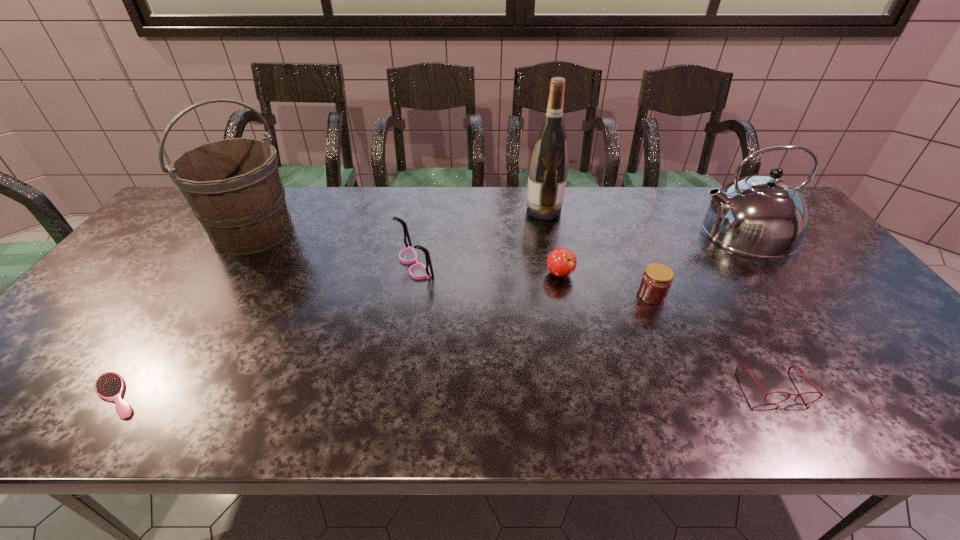
The image size is (960, 540). What are the coordinates of `free space between the apple and the sixth farthest object` in the screenshot? It's located at (606, 285).

At what (x,y) coordinates should I click in order to perform the action: click on unoccupied area between the apple and the sixth object from left to right. Please return your answer as a coordinate pair (x, y). Looking at the image, I should click on (606, 285).

Locate an element on the screen. object that is the fourth closest to the sixth farthest object is located at coordinates tap(548, 167).

You are a GUI agent. You are given a task and a screenshot of the screen. Output one action in this format:
    pyautogui.click(x=<x>, y=<y>)
    Task: Click on the object that is the sixth closest one to the hairbrush
    The height and width of the screenshot is (540, 960).
    Given the screenshot: What is the action you would take?
    pyautogui.click(x=801, y=371)

Where is `vacant point that satisfies the following two spatial constraints: 1. on the label of the wine bottle; 2. on the front side of the shortest object`? The image size is (960, 540). vacant point that satisfies the following two spatial constraints: 1. on the label of the wine bottle; 2. on the front side of the shortest object is located at coordinates (580, 395).